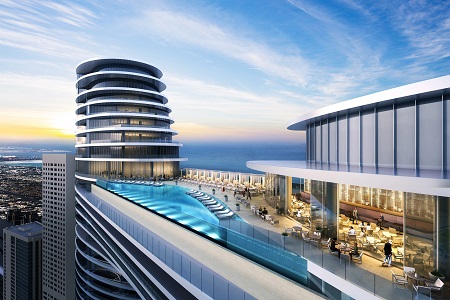
Locate an element on the screen. The width and height of the screenshot is (450, 300). potted plants is located at coordinates (237, 207), (225, 199), (287, 238), (214, 190), (200, 186).